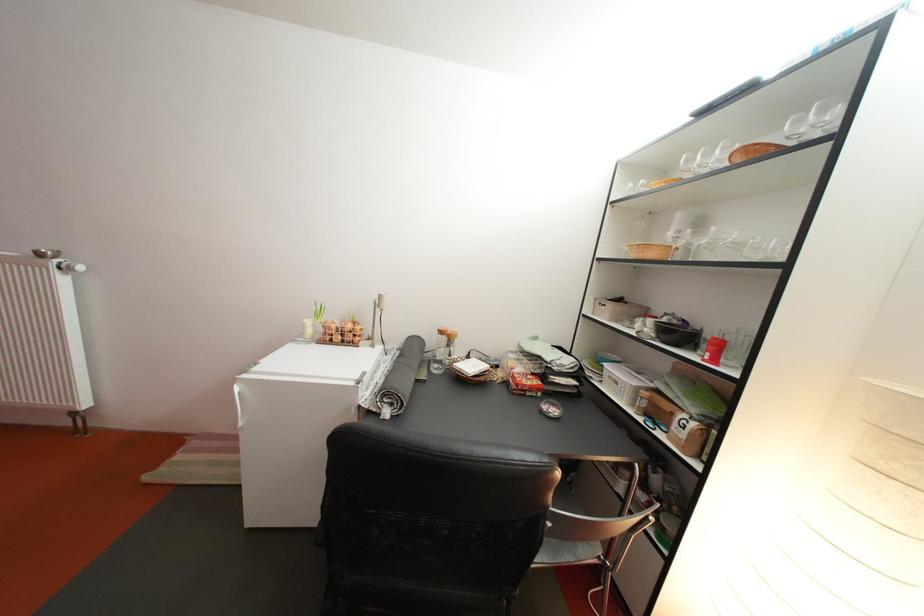
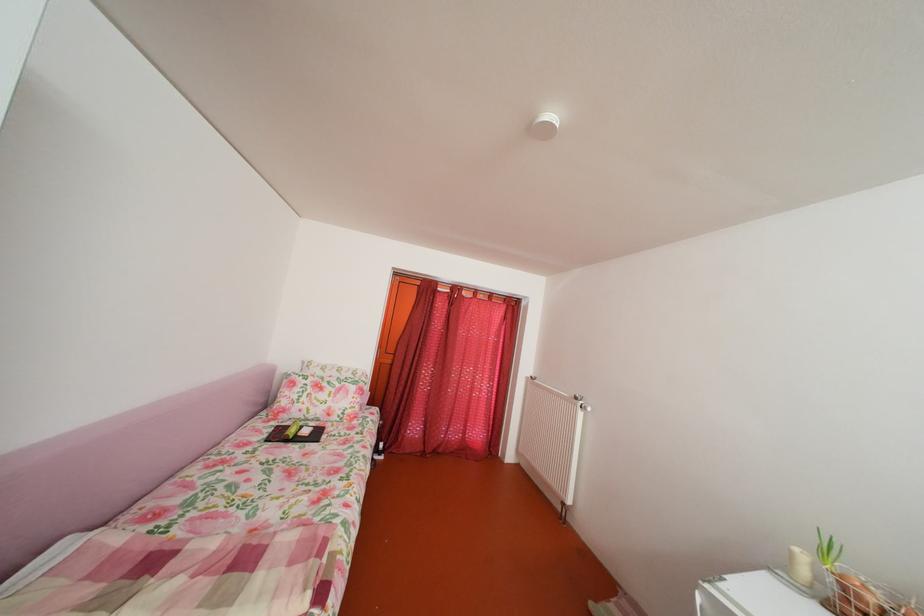
Locate, in the second image, the point that corresponds to point 314,331 in the first image.

(803, 561)